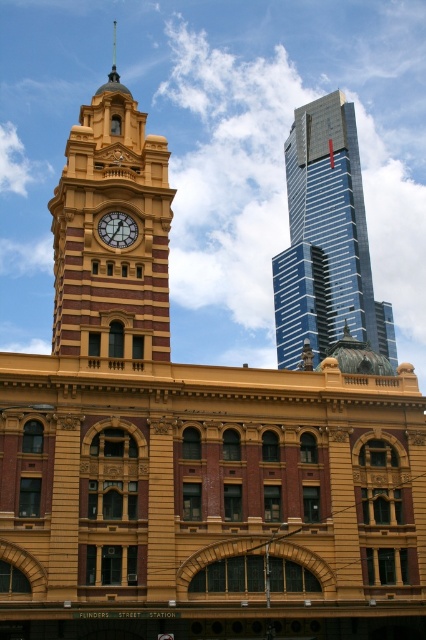
You are an architect analyzing the image. You need to determine which object has a larger physical size between the shiny glass skyscraper at upper right and the matte gold clock at center. Based on the scene, what is your conclusion?

The shiny glass skyscraper at upper right is bigger than the matte gold clock at center, so the skyscraper has a larger physical size.

You are standing at the Flinders Street Station and want to take a photo of the matte yellow clock tower at center. According to the coordinates provided, where should you position yourself to capture it in the frame?

The matte yellow clock tower at center is located at coordinates point (103, 241), so you should position yourself facing that coordinate to capture it in the frame.